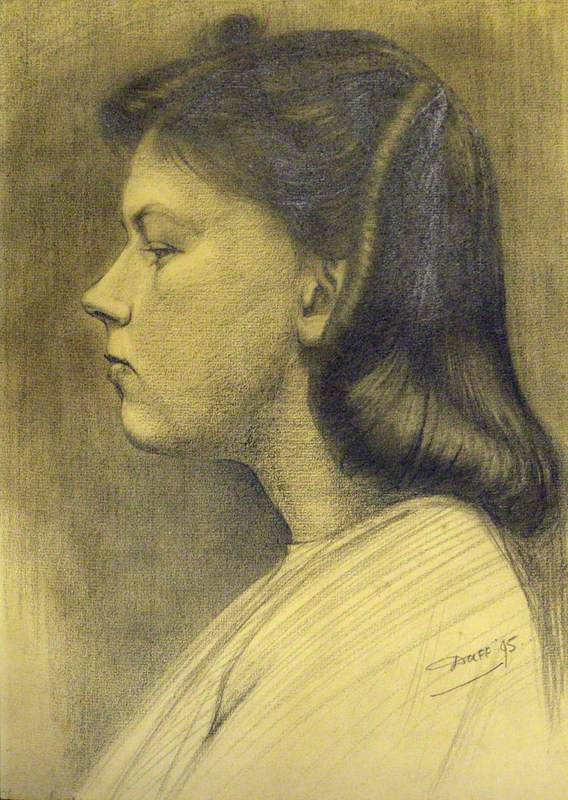
Find the location of a particular element. background is a greenish gray and cream color is located at coordinates (520, 44).